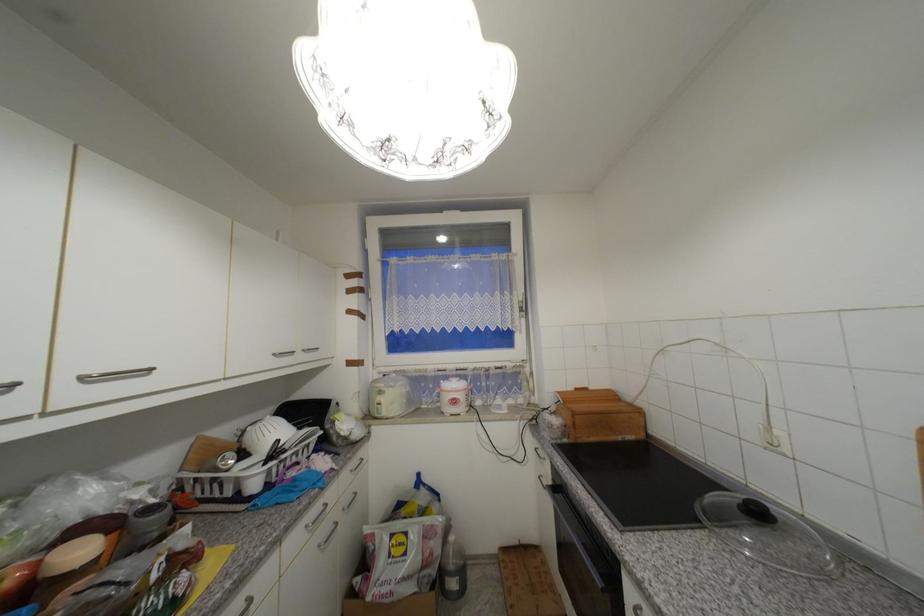
Describe the element at coordinates (600, 416) in the screenshot. I see `the wooden bread box` at that location.